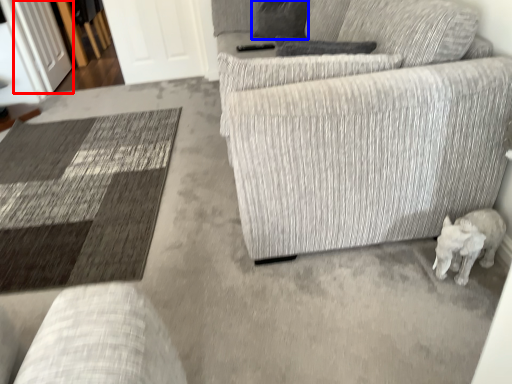
Question: Which of the following is the closest to the observer, glass door (highlighted by a red box) or pillow (highlighted by a blue box)?

Choices:
 (A) glass door
 (B) pillow

Answer: (B)